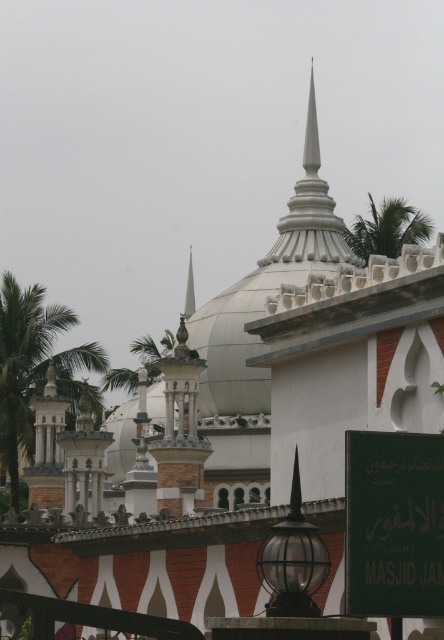
Question: Which point is closer to the camera?

Choices:
 (A) green leafy palm tree at left
 (B) green leafy palm tree at upper right
 (C) white glossy spire at center
 (D) white smooth spire at upper center

Answer: (B)

Question: Is green metallic sign at center to the left of black glass globe at center from the viewer's perspective?

Choices:
 (A) yes
 (B) no

Answer: (B)

Question: Which point appears closest to the camera in this image?

Choices:
 (A) (x=26, y=337)
 (B) (x=293, y=220)
 (C) (x=405, y=202)

Answer: (A)

Question: Observing the image, what is the correct spatial positioning of green leafy palm tree at left in reference to green leafy palm tree at upper right?

Choices:
 (A) left
 (B) right

Answer: (A)

Question: Which object is farther from the camera taking this photo?

Choices:
 (A) black glass globe at center
 (B) green leafy palm tree at upper right
 (C) white glossy spire at center

Answer: (C)

Question: Does green metallic sign at center have a smaller size compared to green leafy palm tree at left?

Choices:
 (A) no
 (B) yes

Answer: (B)